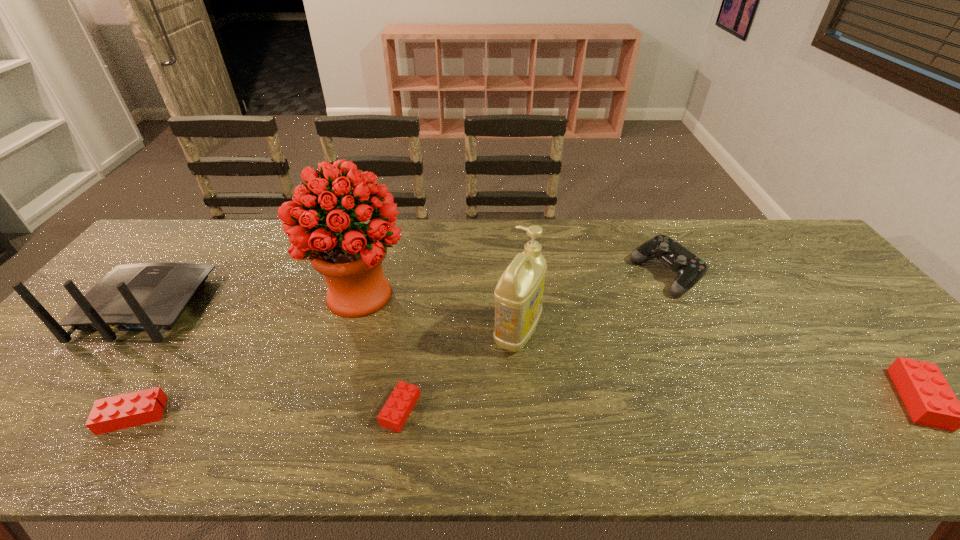
I want to click on unoccupied position between the tallest object and the third tallest object, so click(x=252, y=301).

Point out which object is positioned as the second nearest to the second shortest object. Please provide its 2D coordinates. Your answer should be formatted as a tuple, i.e. [(x, y)], where the tuple contains the x and y coordinates of a point satisfying the conditions above.

[(325, 228)]

The height and width of the screenshot is (540, 960). Find the location of `the third closest object relative to the rightmost object`. the third closest object relative to the rightmost object is located at coordinates (394, 414).

At what (x,y) coordinates should I click in order to perform the action: click on the closest Lego to the third shortest object. Please return your answer as a coordinate pair (x, y). Looking at the image, I should click on (394, 414).

Locate which Lego is the second closest to the fourth shortest object. Please provide its 2D coordinates. Your answer should be formatted as a tuple, i.e. [(x, y)], where the tuple contains the x and y coordinates of a point satisfying the conditions above.

[(394, 414)]

Locate an element on the screen. vacant point that satisfies the following two spatial constraints: 1. on the back side of the third object from right to left; 2. on the left side of the leftmost Lego is located at coordinates (188, 332).

In order to click on vacant area that satisfies the following two spatial constraints: 1. on the back side of the leftmost Lego; 2. on the right side of the second tallest object in this screenshot , I will do `click(188, 332)`.

Find the location of a particular element. Image resolution: width=960 pixels, height=540 pixels. vacant region that satisfies the following two spatial constraints: 1. on the front side of the tallest object; 2. on the left side of the second Lego from right to left is located at coordinates (325, 410).